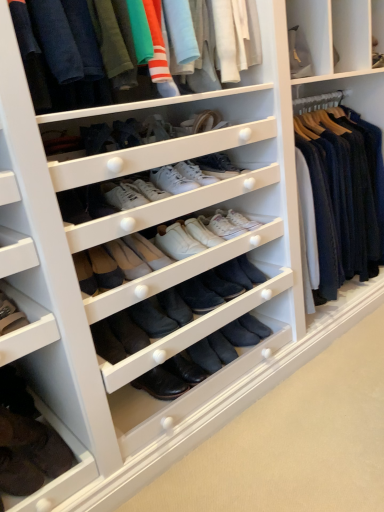
Question: Considering the relative positions of white leather sneakers at center, which ranks as the second shoe in top-to-bottom order, and leather boot at lower left, which is the second footwear from bottom to top, in the image provided, is white leather sneakers at center, which ranks as the second shoe in top-to-bottom order, to the left of leather boot at lower left, which is the second footwear from bottom to top, from the viewer's perspective?

Choices:
 (A) no
 (B) yes

Answer: (A)

Question: Considering the relative sizes of white leather sneakers at center, which ranks as the 4th shoe in bottom-to-top order, and leather boot at lower left, which is the second footwear from bottom to top, in the image provided, is white leather sneakers at center, which ranks as the 4th shoe in bottom-to-top order, wider than leather boot at lower left, which is the second footwear from bottom to top,?

Choices:
 (A) yes
 (B) no

Answer: (A)

Question: From the image's perspective, is white leather sneakers at center, which ranks as the 4th shoe in bottom-to-top order, below leather boot at lower left, the 1th footwear when ordered from top to bottom?

Choices:
 (A) yes
 (B) no

Answer: (B)

Question: From the image's perspective, is white leather sneakers at center, which ranks as the second shoe in top-to-bottom order, located above leather boot at lower left, which is the second footwear from bottom to top?

Choices:
 (A) no
 (B) yes

Answer: (B)

Question: Is white leather sneakers at center, which ranks as the 4th shoe in bottom-to-top order, behind leather boot at lower left, which is the second footwear from bottom to top?

Choices:
 (A) yes
 (B) no

Answer: (A)

Question: From the image's perspective, relative to leather boot at lower left, the 1th footwear when ordered from top to bottom, is black leather boot at center, which appears as the 1th shoe when ordered from the bottom, above or below?

Choices:
 (A) below
 (B) above

Answer: (A)

Question: Is black leather boot at center, positioned as the 5th shoe in top-to-bottom order, taller or shorter than leather boot at lower left, which is the second footwear from bottom to top?

Choices:
 (A) tall
 (B) short

Answer: (B)

Question: Is black leather boot at center, which appears as the 1th shoe when ordered from the bottom, bigger or smaller than leather boot at lower left, the 1th footwear when ordered from top to bottom?

Choices:
 (A) small
 (B) big

Answer: (A)

Question: Do you think black leather boot at center, which appears as the 1th shoe when ordered from the bottom, is within leather boot at lower left, which is the second footwear from bottom to top, or outside of it?

Choices:
 (A) inside
 (B) outside

Answer: (B)

Question: From their relative heights in the image, would you say black leather boot at center, positioned as the 5th shoe in top-to-bottom order, is taller or shorter than white leather sneakers at center, which ranks as the 4th shoe in bottom-to-top order?

Choices:
 (A) tall
 (B) short

Answer: (B)

Question: Relative to white leather sneakers at center, which ranks as the 4th shoe in bottom-to-top order, is black leather boot at center, positioned as the 5th shoe in top-to-bottom order, in front or behind?

Choices:
 (A) behind
 (B) front

Answer: (A)

Question: From the image's perspective, is black leather boot at center, which appears as the 1th shoe when ordered from the bottom, located above or below white leather sneakers at center, which ranks as the 4th shoe in bottom-to-top order?

Choices:
 (A) above
 (B) below

Answer: (B)

Question: Is black leather boot at center, positioned as the 5th shoe in top-to-bottom order, spatially inside white leather sneakers at center, which ranks as the second shoe in top-to-bottom order, or outside of it?

Choices:
 (A) outside
 (B) inside

Answer: (A)

Question: Which is correct: matte cotton t-shirts at upper center is inside white leather sneakers at center, which ranks as the 4th shoe in bottom-to-top order, or outside of it?

Choices:
 (A) inside
 (B) outside

Answer: (B)

Question: Is point (235, 47) closer or farther from the camera than point (160, 167)?

Choices:
 (A) farther
 (B) closer

Answer: (B)